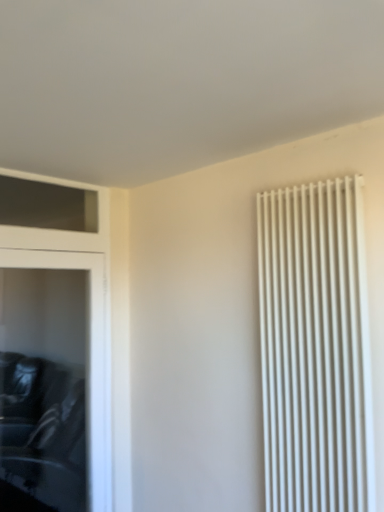
Question: Considering their positions, is black leather dresser at left located in front of or behind white matte radiator at right?

Choices:
 (A) front
 (B) behind

Answer: (B)

Question: In the image, is black leather dresser at left on the left side or the right side of white matte radiator at right?

Choices:
 (A) left
 (B) right

Answer: (A)

Question: Does point (109, 338) appear closer or farther from the camera than point (264, 274)?

Choices:
 (A) closer
 (B) farther

Answer: (B)

Question: From a real-world perspective, is white matte radiator at right positioned above or below black leather dresser at left?

Choices:
 (A) above
 (B) below

Answer: (A)

Question: Is point (309, 357) positioned closer to the camera than point (56, 265)?

Choices:
 (A) closer
 (B) farther

Answer: (A)

Question: From the image's perspective, is white matte radiator at right above or below black leather dresser at left?

Choices:
 (A) below
 (B) above

Answer: (B)

Question: Is white matte radiator at right inside or outside of black leather dresser at left?

Choices:
 (A) inside
 (B) outside

Answer: (B)